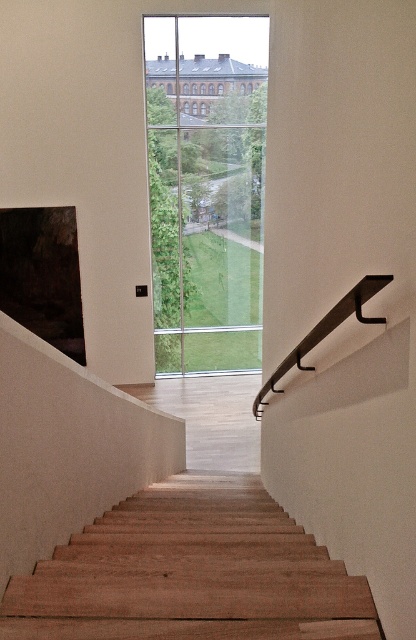
Question: Which of these objects is positioned closest to the clear glass window at center?

Choices:
 (A) black metal handrail at upper right
 (B) wooden stairs at center

Answer: (B)

Question: In this image, where is wooden stairs at center located relative to clear glass window at center?

Choices:
 (A) above
 (B) below

Answer: (B)

Question: Is wooden stairs at center to the left of black metal handrail at upper right from the viewer's perspective?

Choices:
 (A) no
 (B) yes

Answer: (B)

Question: Is clear glass window at center to the right of black metal handrail at upper right from the viewer's perspective?

Choices:
 (A) no
 (B) yes

Answer: (A)

Question: Estimate the real-world distances between objects in this image. Which object is farther from the clear glass window at center?

Choices:
 (A) black metal handrail at upper right
 (B) wooden stairs at center

Answer: (A)

Question: Estimate the real-world distances between objects in this image. Which object is closer to the wooden stairs at center?

Choices:
 (A) clear glass window at center
 (B) black metal handrail at upper right

Answer: (B)